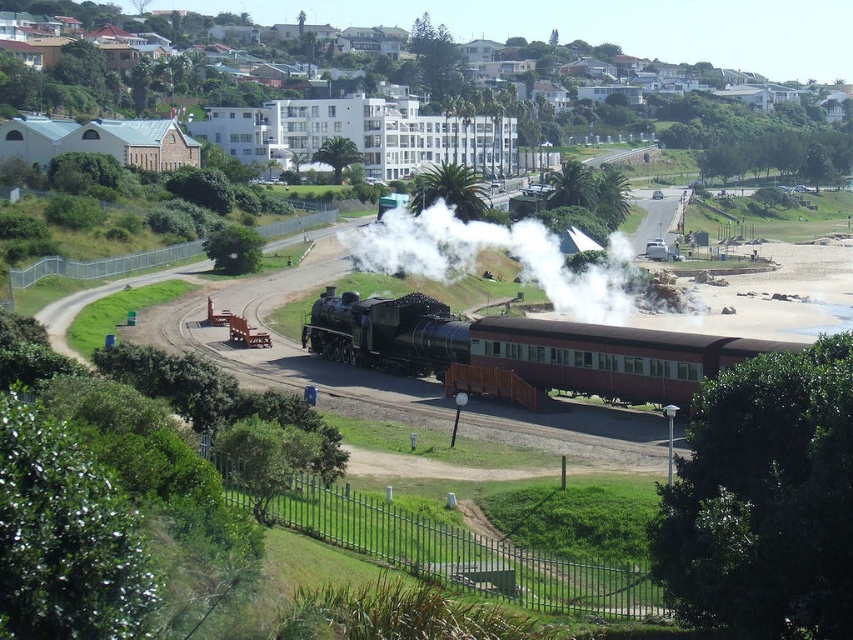
Is point (317, 304) farther from camera compared to point (370, 365)?

Yes, point (317, 304) is farther from viewer.

How much distance is there between matte black train at center and shiny black locomotive at center?

matte black train at center is 2.65 meters from shiny black locomotive at center.

Identify the location of matte black train at center. (521, 349).

At what (x,y) coordinates should I click in order to perform the action: click on matte black train at center. Please return your answer as a coordinate pair (x, y). Looking at the image, I should click on (521, 349).

Is white smoke at center positioned at the back of shiny black locomotive at center?

Yes, white smoke at center is behind shiny black locomotive at center.

This screenshot has width=853, height=640. Describe the element at coordinates (497, 250) in the screenshot. I see `white smoke at center` at that location.

Identify the location of white smoke at center. Image resolution: width=853 pixels, height=640 pixels. (497, 250).

Is white smooth building at upper center wider than white smoke at center?

Correct, the width of white smooth building at upper center exceeds that of white smoke at center.

Measure the distance between white smooth building at upper center and camera.

white smooth building at upper center and camera are 150.39 meters apart.

Locate an element on the screen. The height and width of the screenshot is (640, 853). white smooth building at upper center is located at coordinates (393, 120).

This screenshot has height=640, width=853. What are the coordinates of `white smooth building at upper center` in the screenshot? It's located at (393, 120).